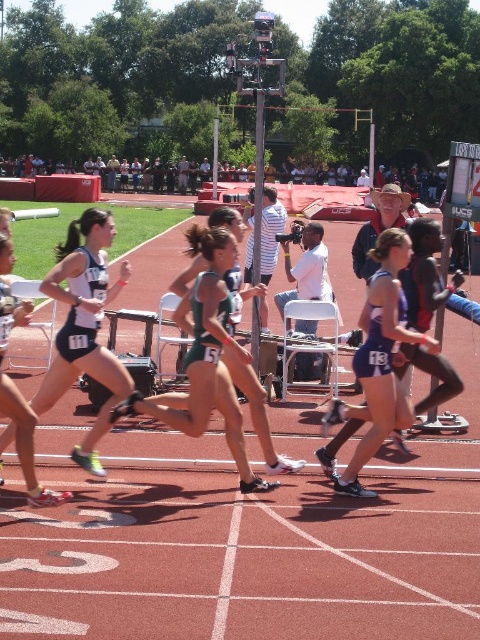
You are a photographer at the track and field event. You need to capture a photo of the athlete wearing the matte black shorts at center and the athlete in the green athletic uniform at center. Which athlete is shorter in height?

The matte black shorts at center is not as tall as green athletic uniform at center, so the athlete wearing the matte black shorts at center is shorter in height than the athlete in the green athletic uniform at center.